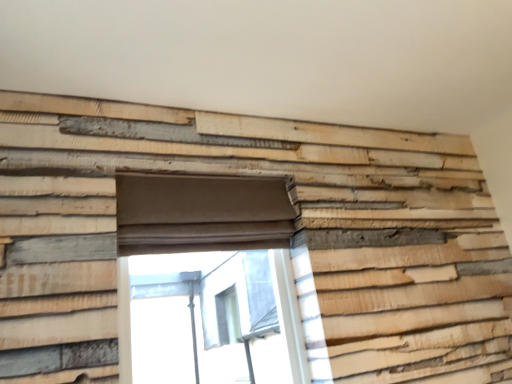
Describe the element at coordinates (215, 284) in the screenshot. The height and width of the screenshot is (384, 512). I see `transparent glass window at center` at that location.

What is the approximate width of transparent glass window at center?

The width of transparent glass window at center is 2.43 inches.

Find the location of a particular element. The height and width of the screenshot is (384, 512). transparent glass window at center is located at coordinates (215, 284).

Find the location of a particular element. This screenshot has height=384, width=512. transparent glass window at center is located at coordinates (215, 284).